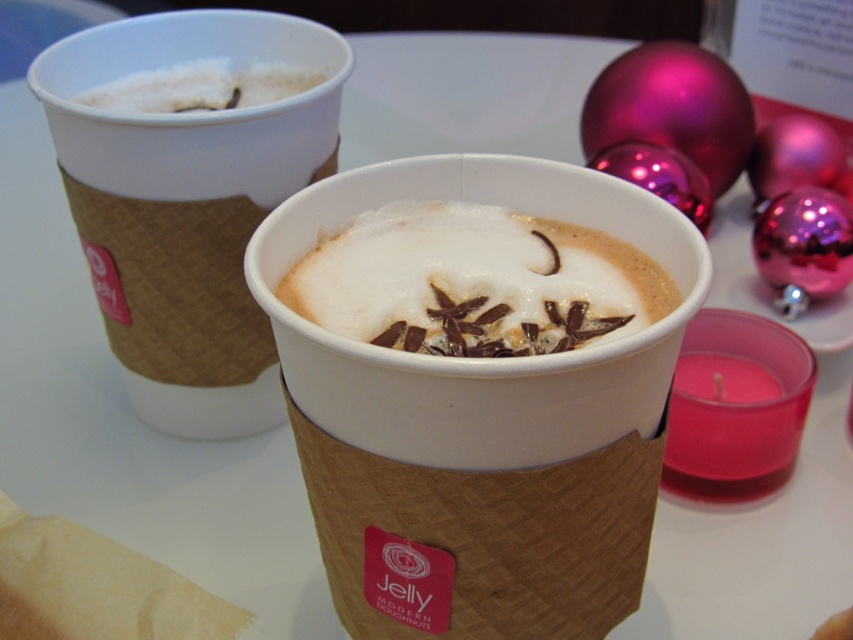
From the picture: Is white frothy foam at center smaller than white frothy foam at upper left?

No, white frothy foam at center is not smaller than white frothy foam at upper left.

Is white frothy foam at center above white frothy foam at upper left?

Actually, white frothy foam at center is below white frothy foam at upper left.

I want to click on white frothy foam at center, so [474, 282].

Which is more to the right, white foam coffee at upper left or white frothy foam at center?

From the viewer's perspective, white frothy foam at center appears more on the right side.

Describe the element at coordinates (189, 193) in the screenshot. I see `white foam coffee at upper left` at that location.

At what (x,y) coordinates should I click in order to perform the action: click on white foam coffee at upper left. Please return your answer as a coordinate pair (x, y). This screenshot has width=853, height=640. Looking at the image, I should click on (189, 193).

Does white foam coffee at upper left appear over white frothy foam at upper left?

No.

Measure the distance between point (138, 232) and camera.

The distance of point (138, 232) from camera is 1.06 meters.

You are a GUI agent. You are given a task and a screenshot of the screen. Output one action in this format:
    pyautogui.click(x=<x>, y=<y>)
    Task: Click on the white foam coffee at upper left
    The image size is (853, 640).
    Given the screenshot: What is the action you would take?
    pyautogui.click(x=189, y=193)